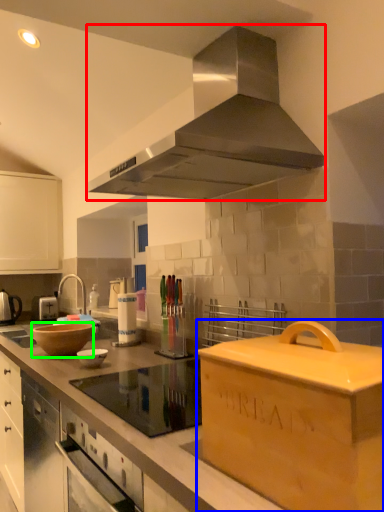
Question: Based on their relative distances, which object is farther from home appliance (highlighted by a red box)? Choose from cardboard box (highlighted by a blue box) and mixing bowl (highlighted by a green box).

Choices:
 (A) cardboard box
 (B) mixing bowl

Answer: (B)